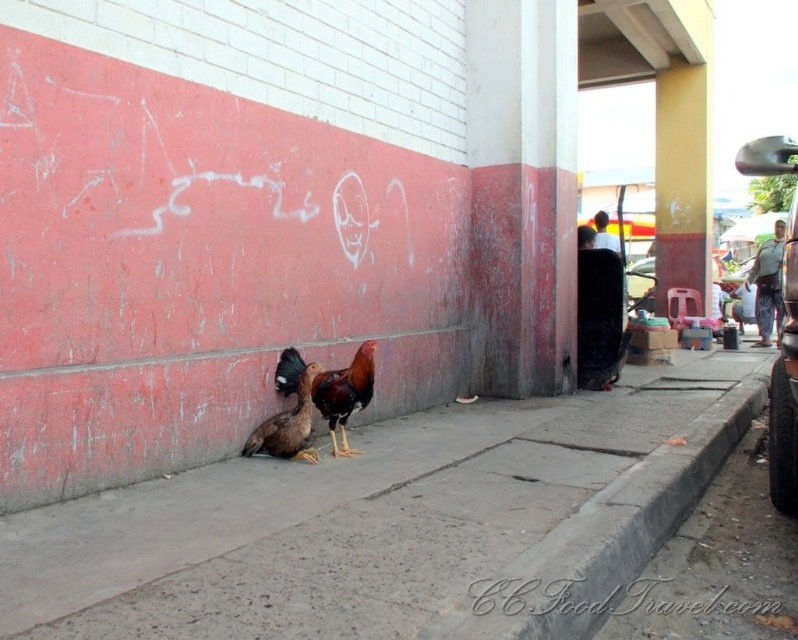
You are standing at the point labeled as point (374,474) in the image. A friend is holding a ball and wants to throw it to you. If the ball travels in a straight line, will it pass over the wall that is painted red at the bottom and white at the top? Please explain your reasoning based on the distance between you and the viewer.

The distance between you and the viewer is 3.03 meters. Since the wall is part of the urban street scene and the point is on the sidewalk, the ball thrown in a straight line would likely pass over the wall if it is within that distance. However, without knowing the wall height, we can only confirm the horizontal distance. The ball could clear the wall if the throw has sufficient arc, but the provided information doesn not specify wall dimensions.